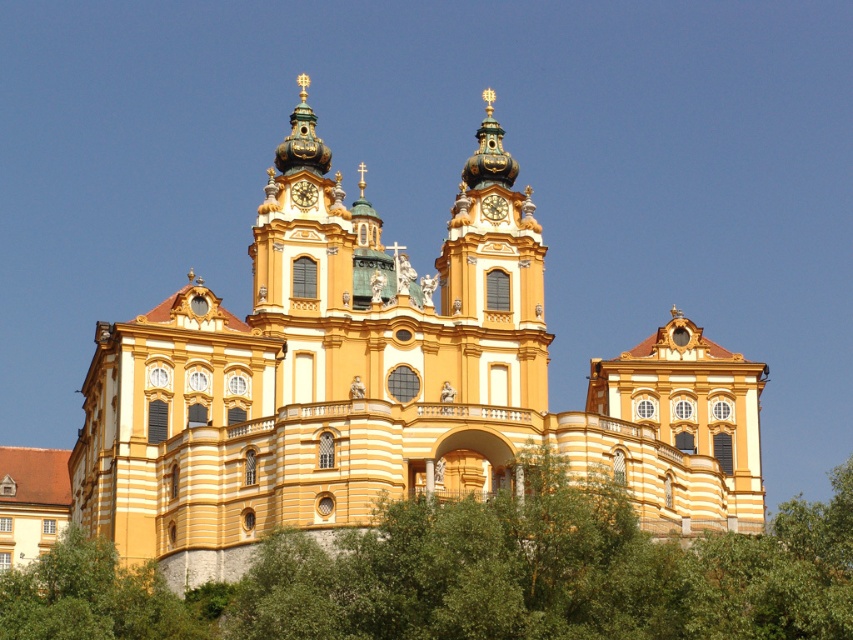
Is yellow matte church at center bigger than green leafy tree at lower center?

Yes, yellow matte church at center is bigger than green leafy tree at lower center.

Is yellow matte church at center thinner than green leafy tree at lower center?

Indeed, yellow matte church at center has a lesser width compared to green leafy tree at lower center.

At what (x,y) coordinates should I click in order to perform the action: click on yellow matte church at center. Please return your answer as a coordinate pair (x, y). The height and width of the screenshot is (640, 853). Looking at the image, I should click on (386, 385).

Which of these two, green leafy tree at lower center or gold metallic clock at upper center, stands shorter?

Standing shorter between the two is gold metallic clock at upper center.

Is point (599, 604) positioned behind point (498, 208)?

No, (599, 604) is in front of (498, 208).

Measure the distance between point (260, 592) and camera.

Point (260, 592) is 65.10 meters away from camera.

You are a GUI agent. You are given a task and a screenshot of the screen. Output one action in this format:
    pyautogui.click(x=<x>, y=<y>)
    Task: Click on the green leafy tree at lower center
    The height and width of the screenshot is (640, 853).
    Given the screenshot: What is the action you would take?
    pyautogui.click(x=473, y=577)

Does green leafy tree at lower center appear on the left side of green leafy tree at lower left?

No, green leafy tree at lower center is not to the left of green leafy tree at lower left.

At what (x,y) coordinates should I click in order to perform the action: click on green leafy tree at lower center. Please return your answer as a coordinate pair (x, y). Image resolution: width=853 pixels, height=640 pixels. Looking at the image, I should click on (473, 577).

Between point (556, 497) and point (73, 561), which one is positioned behind?

Positioned behind is point (73, 561).

Locate an element on the screen. Image resolution: width=853 pixels, height=640 pixels. green leafy tree at lower center is located at coordinates (473, 577).